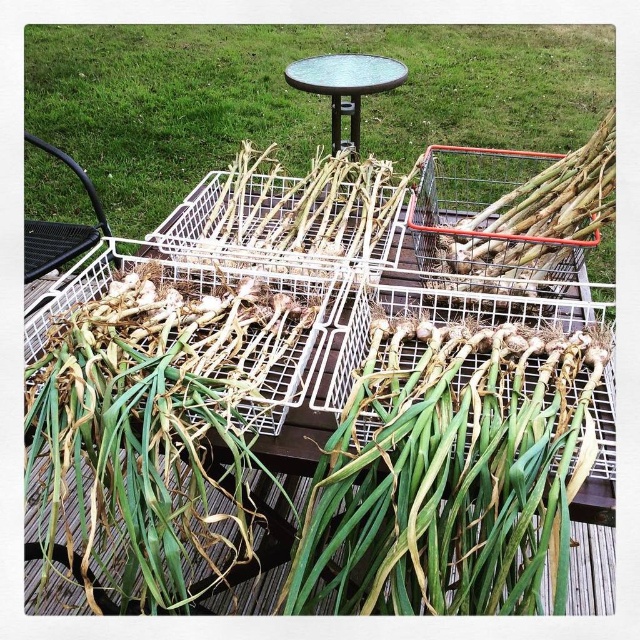
Question: From the image, what is the correct spatial relationship of green leafy grass at center in relation to green glass table at center?

Choices:
 (A) above
 (B) below

Answer: (A)

Question: In this image, where is green leafy grass at center located relative to green glass table at center?

Choices:
 (A) above
 (B) below

Answer: (A)

Question: From the image, what is the correct spatial relationship of green leafy grass at center in relation to green glass table at center?

Choices:
 (A) right
 (B) left

Answer: (A)

Question: Which point is farther from the camera taking this photo?

Choices:
 (A) (461, 125)
 (B) (305, 72)

Answer: (A)